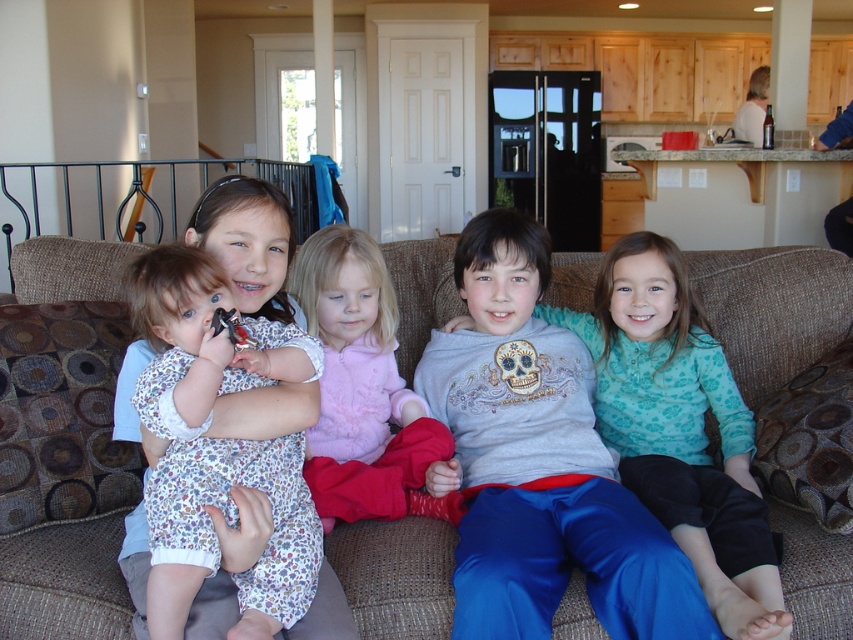
You are a parent trying to place a 24 inch long toy box between the brown fabric couch at center and the matte gray sweatshirt at center. Can the toy box fit in the space between them?

The brown fabric couch at center is 26.64 inches from matte gray sweatshirt at center, so the 24 inch toy box can fit between them since the distance is greater than the toy box length.

In the living room scene, there are two children wearing a matte gray sweatshirt at center and a fluffy pink sweater at center. Which child is sitting to the right of the other?

The matte gray sweatshirt at center is to the right of the fluffy pink sweater at center.